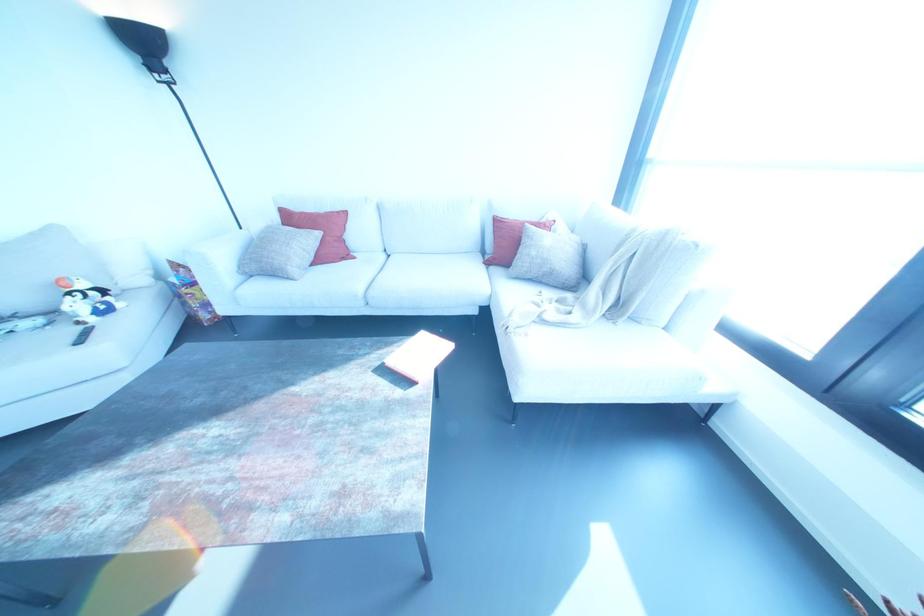
This screenshot has height=616, width=924. Find the location of `red pillow`. red pillow is located at coordinates (322, 233).